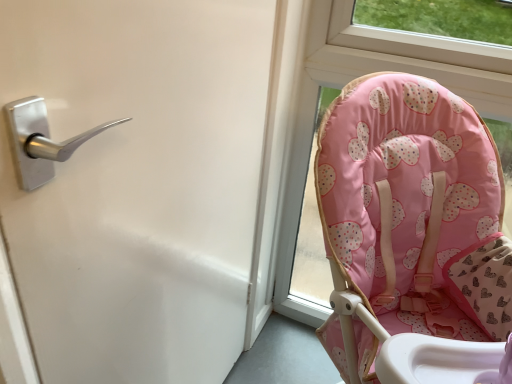
Question: Is point (114, 210) closer or farther from the camera than point (479, 208)?

Choices:
 (A) farther
 (B) closer

Answer: (B)

Question: Considering the relative positions of silver metallic handle at upper left and pink fabric baby chair at right in the image provided, is silver metallic handle at upper left to the left or to the right of pink fabric baby chair at right?

Choices:
 (A) right
 (B) left

Answer: (B)

Question: Is silver metallic handle at upper left inside or outside of pink fabric baby chair at right?

Choices:
 (A) inside
 (B) outside

Answer: (B)

Question: Looking at the image, does pink fabric baby chair at right seem bigger or smaller compared to silver metallic handle at upper left?

Choices:
 (A) big
 (B) small

Answer: (A)

Question: Is pink fabric baby chair at right inside or outside of silver metallic handle at upper left?

Choices:
 (A) inside
 (B) outside

Answer: (B)

Question: Considering the positions of pink fabric baby chair at right and silver metallic handle at upper left in the image, is pink fabric baby chair at right wider or thinner than silver metallic handle at upper left?

Choices:
 (A) thin
 (B) wide

Answer: (B)

Question: Considering their positions, is pink fabric baby chair at right located in front of or behind silver metallic handle at upper left?

Choices:
 (A) front
 (B) behind

Answer: (B)